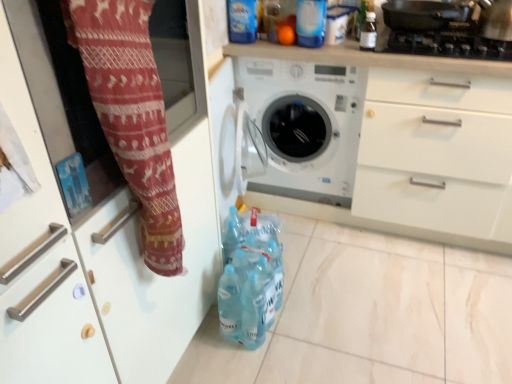
Question: From a real-world perspective, is white plastic washing machine at center physically located above or below transparent plastic bottle at upper right, placed as the first bottle when sorted from right to left?

Choices:
 (A) above
 (B) below

Answer: (B)

Question: Considering the positions of point (365, 72) and point (371, 26), is point (365, 72) closer or farther from the camera than point (371, 26)?

Choices:
 (A) closer
 (B) farther

Answer: (A)

Question: Which object is positioned farthest from the red knit fabric at left?

Choices:
 (A) black matte gas stove at upper right
 (B) white plastic washing machine at center
 (C) translucent plastic bottles at lower center, placed as the first bottle when sorted from bottom to top
 (D) transparent plastic bottle at upper right, which is the 1th bottle from top to bottom

Answer: (A)

Question: Estimate the real-world distances between objects in this image. Which object is farther from the translucent plastic bottles at lower center, placed as the first bottle when sorted from bottom to top?

Choices:
 (A) transparent plastic bottle at upper right, which is the 1th bottle from top to bottom
 (B) white plastic washing machine at center
 (C) black matte gas stove at upper right
 (D) red knit fabric at left

Answer: (C)